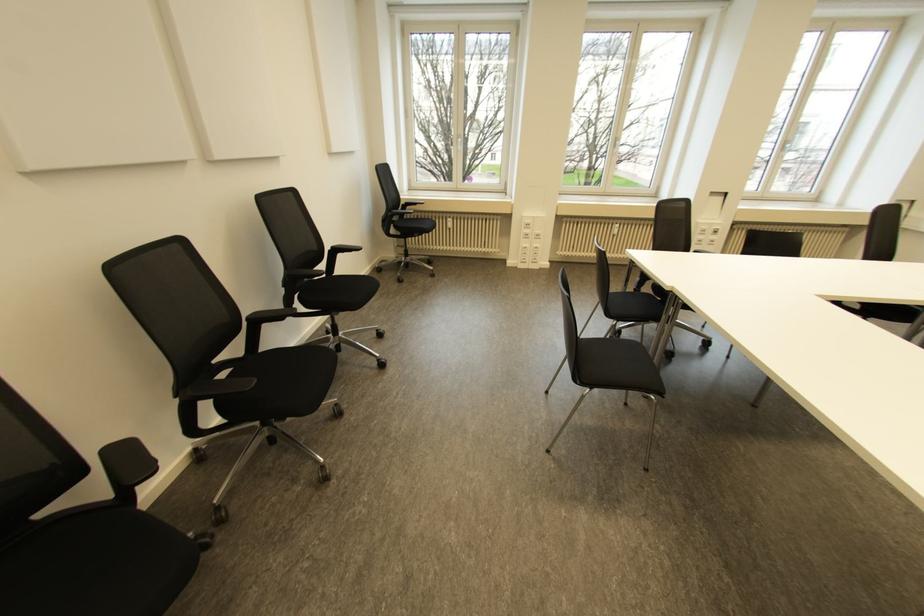
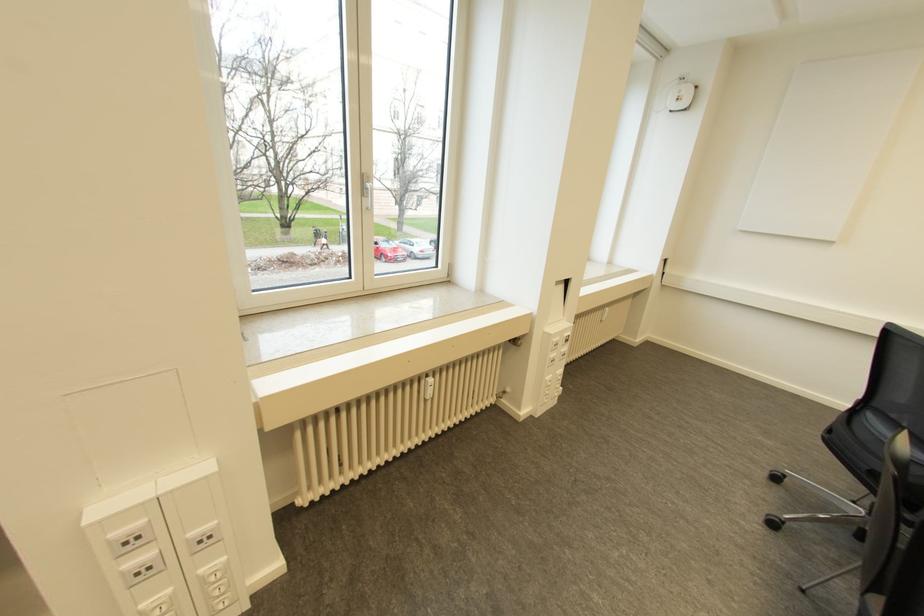
Find the pixel in the second image that matches pixel 614 150 in the first image.

(366, 201)